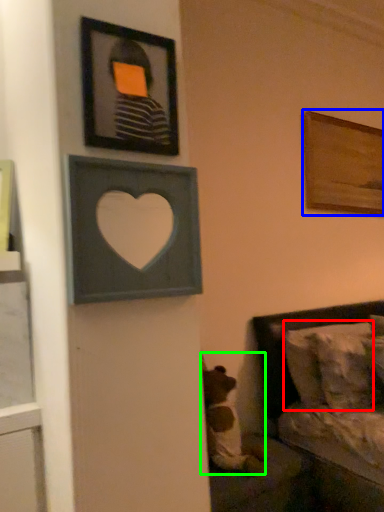
Question: Which object is positioned farthest from pillow (highlighted by a red box)? Select from picture frame (highlighted by a blue box) and animal (highlighted by a green box).

Choices:
 (A) picture frame
 (B) animal

Answer: (A)